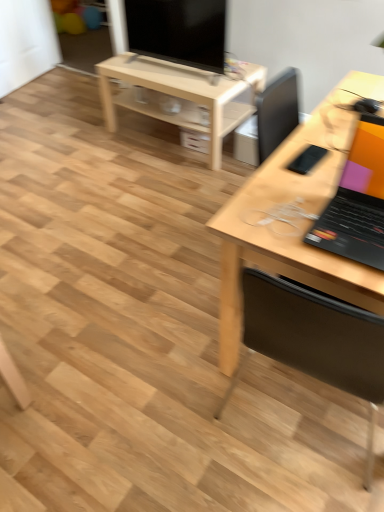
Identify the location of vacant space situated on the left part of light wood/unfinished table at center. (88, 152).